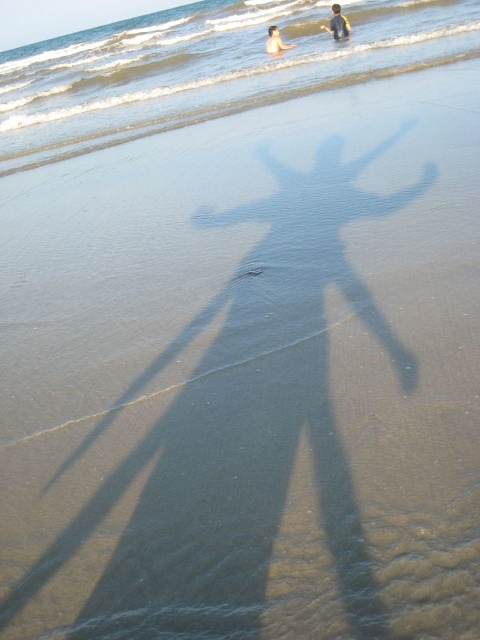
Question: Observing the image, what is the correct spatial positioning of clear water at center in reference to yellow fabric shirt at upper center?

Choices:
 (A) above
 (B) below

Answer: (A)

Question: Among these points, which one is nearest to the camera?

Choices:
 (A) (19, 76)
 (B) (279, 44)
 (C) (336, 3)

Answer: (C)

Question: Which of the following is the farthest from the observer?

Choices:
 (A) smooth skin person at upper center
 (B) clear water at center
 (C) yellow fabric shirt at upper center

Answer: (A)

Question: Which object is closer to the camera taking this photo?

Choices:
 (A) clear water at center
 (B) yellow fabric shirt at upper center
 (C) smooth skin person at upper center

Answer: (A)

Question: Is clear water at center below yellow fabric shirt at upper center?

Choices:
 (A) yes
 (B) no

Answer: (B)

Question: Is yellow fabric shirt at upper center below smooth skin person at upper center?

Choices:
 (A) no
 (B) yes

Answer: (A)